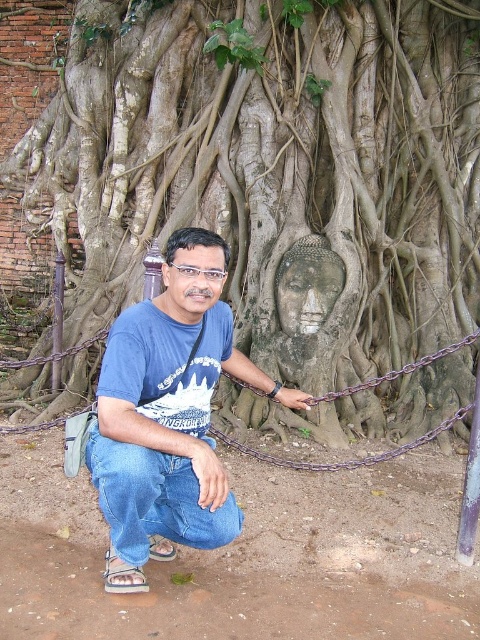
Does blue cotton shirt at center have a lesser height compared to purple metallic chain at center?

No.

Is point (211, 497) positioned after point (219, 432)?

No, (211, 497) is in front of (219, 432).

Locate an element on the screen. Image resolution: width=480 pixels, height=640 pixels. blue cotton shirt at center is located at coordinates (168, 416).

Describe the element at coordinates (275, 164) in the screenshot. I see `gray stone buddha head at center` at that location.

Find the location of a particular element. This screenshot has height=640, width=480. gray stone buddha head at center is located at coordinates (275, 164).

This screenshot has height=640, width=480. I want to click on gray stone buddha head at center, so click(x=275, y=164).

Which is more to the left, blue cotton shirt at center or rusty metal chain at center?

Positioned to the left is blue cotton shirt at center.

Does blue cotton shirt at center come behind rusty metal chain at center?

No, it is in front of rusty metal chain at center.

Between point (147, 481) and point (357, 387), which one is positioned behind?

The point (357, 387) is more distant.

Locate an element on the screen. This screenshot has width=480, height=640. blue cotton shirt at center is located at coordinates (168, 416).